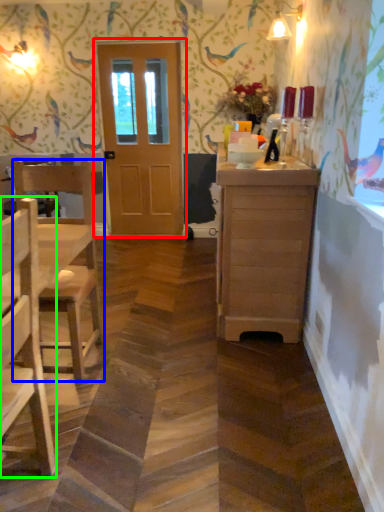
Question: Considering the real-world distances, which object is closest to door (highlighted by a red box)? chair (highlighted by a blue box) or chair (highlighted by a green box).

Choices:
 (A) chair
 (B) chair

Answer: (A)